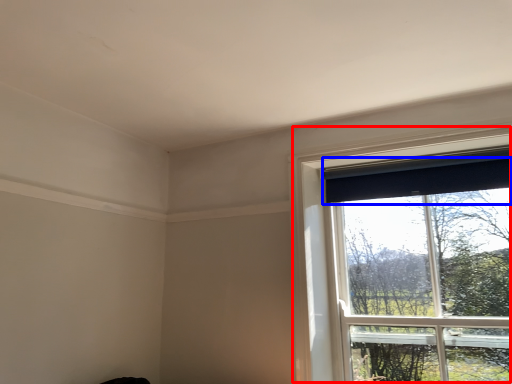
Question: Which object is closer to the camera taking this photo, window (highlighted by a red box) or curtain (highlighted by a blue box)?

Choices:
 (A) window
 (B) curtain

Answer: (A)